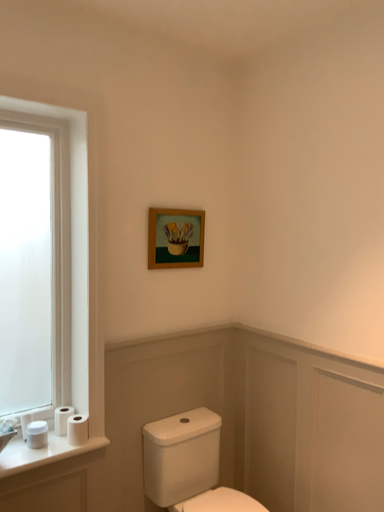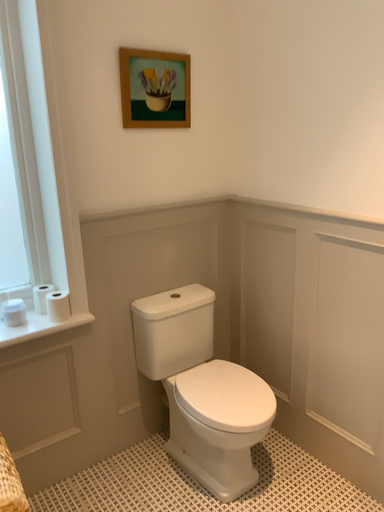
Question: How did the camera likely rotate when shooting the video?

Choices:
 (A) rotated downward
 (B) rotated upward

Answer: (A)